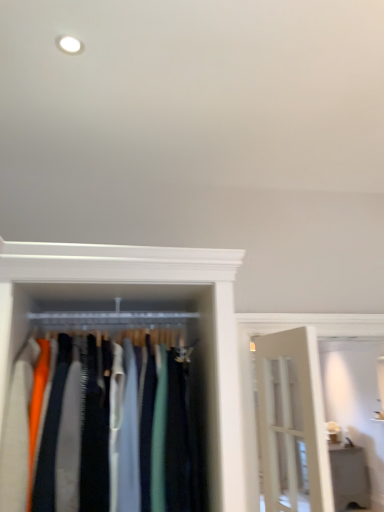
Question: Does white glossy shelf at lower right have a greater height compared to matte fabric clothes at center?

Choices:
 (A) no
 (B) yes

Answer: (A)

Question: Considering the relative sizes of white glossy shelf at lower right and matte fabric clothes at center in the image provided, is white glossy shelf at lower right bigger than matte fabric clothes at center?

Choices:
 (A) yes
 (B) no

Answer: (A)

Question: From the image's perspective, would you say white glossy shelf at lower right is shown under matte fabric clothes at center?

Choices:
 (A) no
 (B) yes

Answer: (B)

Question: Would you say white glossy shelf at lower right is a long distance from matte fabric clothes at center?

Choices:
 (A) yes
 (B) no

Answer: (A)

Question: From a real-world perspective, is white glossy shelf at lower right physically above matte fabric clothes at center?

Choices:
 (A) no
 (B) yes

Answer: (A)

Question: Could matte fabric clothes at center be considered to be inside white glossy shelf at lower right?

Choices:
 (A) no
 (B) yes

Answer: (A)

Question: Is matte fabric clothes at center thinner than white glossy shelf at lower right?

Choices:
 (A) yes
 (B) no

Answer: (B)

Question: Considering the relative sizes of matte fabric clothes at center and white glossy shelf at lower right in the image provided, is matte fabric clothes at center shorter than white glossy shelf at lower right?

Choices:
 (A) no
 (B) yes

Answer: (A)

Question: Can you confirm if matte fabric clothes at center is positioned to the right of white glossy shelf at lower right?

Choices:
 (A) no
 (B) yes

Answer: (A)

Question: Is matte fabric clothes at center surrounding white glossy shelf at lower right?

Choices:
 (A) yes
 (B) no

Answer: (B)

Question: From a real-world perspective, is matte fabric clothes at center beneath white glossy shelf at lower right?

Choices:
 (A) no
 (B) yes

Answer: (A)

Question: From a real-world perspective, is matte fabric clothes at center over white glossy shelf at lower right?

Choices:
 (A) no
 (B) yes

Answer: (B)

Question: Is matte fabric clothes at center situated inside white glossy shelf at lower right or outside?

Choices:
 (A) inside
 (B) outside

Answer: (B)